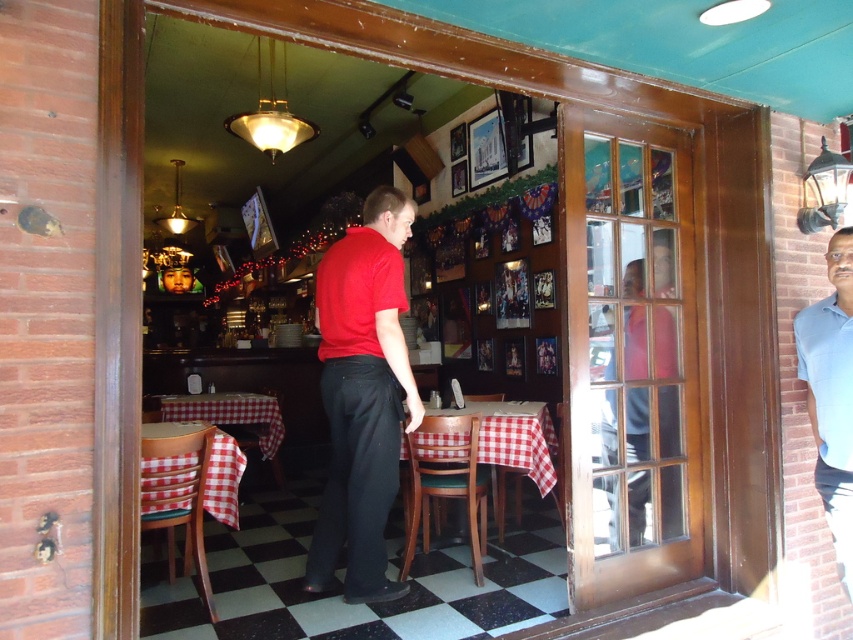
Which is in front, point (846, 561) or point (248, 420)?

Point (846, 561) is more forward.

At what (x,y) coordinates should I click in order to perform the action: click on blue cotton shirt at right. Please return your answer as a coordinate pair (x, y). Looking at the image, I should click on (831, 394).

This screenshot has width=853, height=640. What are the coordinates of `blue cotton shirt at right` in the screenshot? It's located at click(831, 394).

Does point (485, 436) come in front of point (231, 499)?

No, it is behind (231, 499).

Does point (498, 458) come closer to viewer compared to point (231, 516)?

No, it is not.

The image size is (853, 640). I want to click on red checkered tablecloth at center, so click(x=514, y=436).

Is point (320, 376) less distant than point (218, 493)?

No.

Can you confirm if red matte shirt at center is positioned below red checkered fabric at lower left?

Incorrect, red matte shirt at center is not positioned below red checkered fabric at lower left.

The width and height of the screenshot is (853, 640). In order to click on red matte shirt at center in this screenshot , I will do `click(363, 396)`.